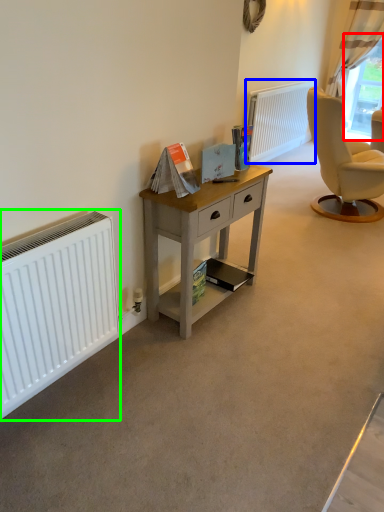
Question: Considering the real-world distances, which object is closest to window screen (highlighted by a red box)? radiator (highlighted by a blue box) or radiator (highlighted by a green box).

Choices:
 (A) radiator
 (B) radiator

Answer: (A)